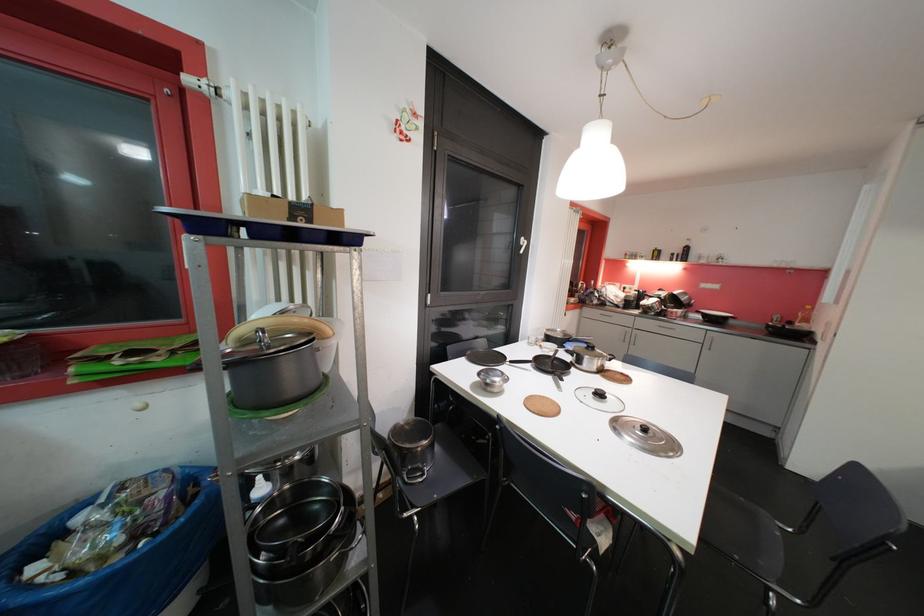
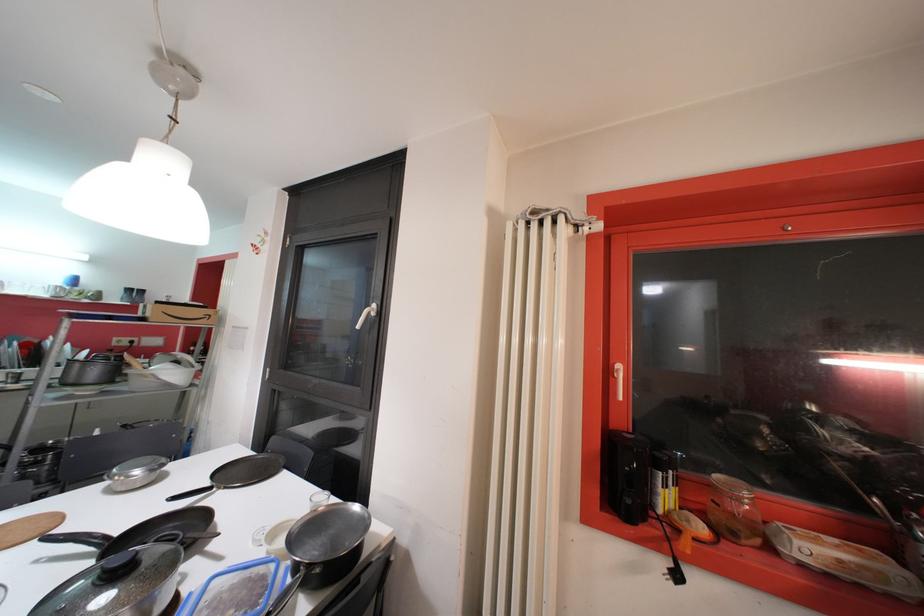
Question: I am providing you with two images of the same scene from different viewpoints. After the viewpoint changes to image2, which objects are now occluded?

Choices:
 (A) chair sitting surface
 (B) clear glass jar
 (C) black metal tool
 (D) blue plastic container

Answer: (A)